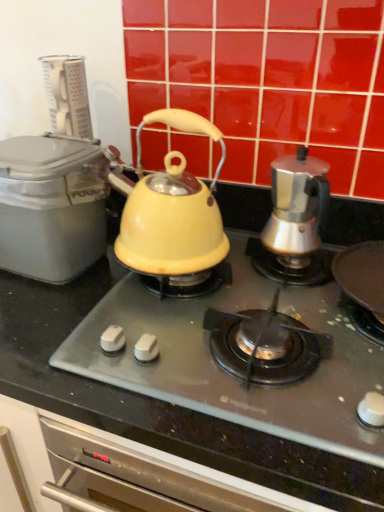
Question: Considering the relative sizes of matte yellow kettle at center and matte gray container at left in the image provided, is matte yellow kettle at center thinner than matte gray container at left?

Choices:
 (A) no
 (B) yes

Answer: (A)

Question: From a real-world perspective, is matte yellow kettle at center below matte gray container at left?

Choices:
 (A) no
 (B) yes

Answer: (B)

Question: From the image's perspective, is matte yellow kettle at center above matte gray container at left?

Choices:
 (A) yes
 (B) no

Answer: (B)

Question: Considering the relative sizes of matte yellow kettle at center and matte gray container at left in the image provided, is matte yellow kettle at center smaller than matte gray container at left?

Choices:
 (A) yes
 (B) no

Answer: (B)

Question: Does matte yellow kettle at center come behind matte gray container at left?

Choices:
 (A) yes
 (B) no

Answer: (B)

Question: From the image's perspective, is matte yellow kettle at center under matte gray container at left?

Choices:
 (A) yes
 (B) no

Answer: (A)

Question: Does matte gray container at left have a greater width compared to matte yellow kettle at center, the 2th kettle positioned from the right?

Choices:
 (A) yes
 (B) no

Answer: (A)

Question: Is matte gray container at left oriented towards matte yellow kettle at center, the 2th kettle positioned from the right?

Choices:
 (A) no
 (B) yes

Answer: (A)

Question: Does matte gray container at left appear on the right side of matte yellow kettle at center, the 2th kettle positioned from the right?

Choices:
 (A) no
 (B) yes

Answer: (A)

Question: Could matte yellow kettle at center, acting as the first kettle starting from the left, be considered to be inside matte gray container at left?

Choices:
 (A) no
 (B) yes

Answer: (A)

Question: Does matte gray container at left appear on the left side of matte yellow kettle at center, the 2th kettle positioned from the right?

Choices:
 (A) no
 (B) yes

Answer: (B)

Question: Can you confirm if matte gray container at left is shorter than matte yellow kettle at center, the 2th kettle positioned from the right?

Choices:
 (A) yes
 (B) no

Answer: (A)

Question: Can you confirm if satin silver coffee maker at right, which is the first kettle in right-to-left order, is thinner than matte yellow kettle at center?

Choices:
 (A) yes
 (B) no

Answer: (A)